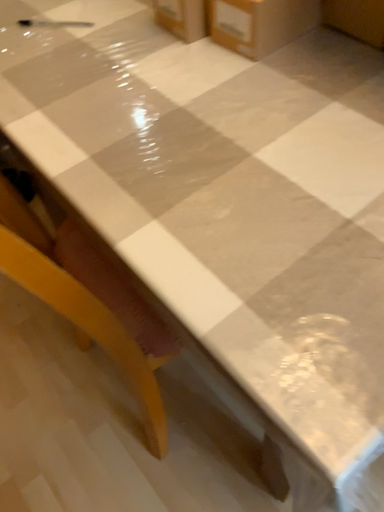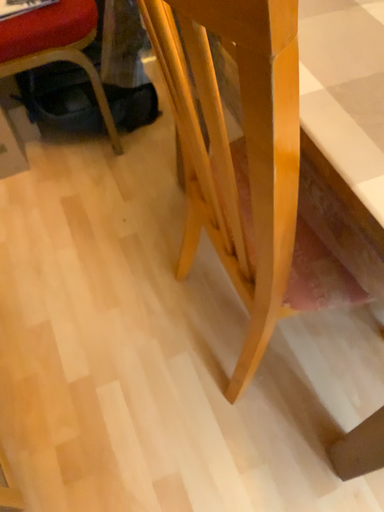
Question: Which way did the camera rotate in the video?

Choices:
 (A) rotated right
 (B) rotated left

Answer: (B)